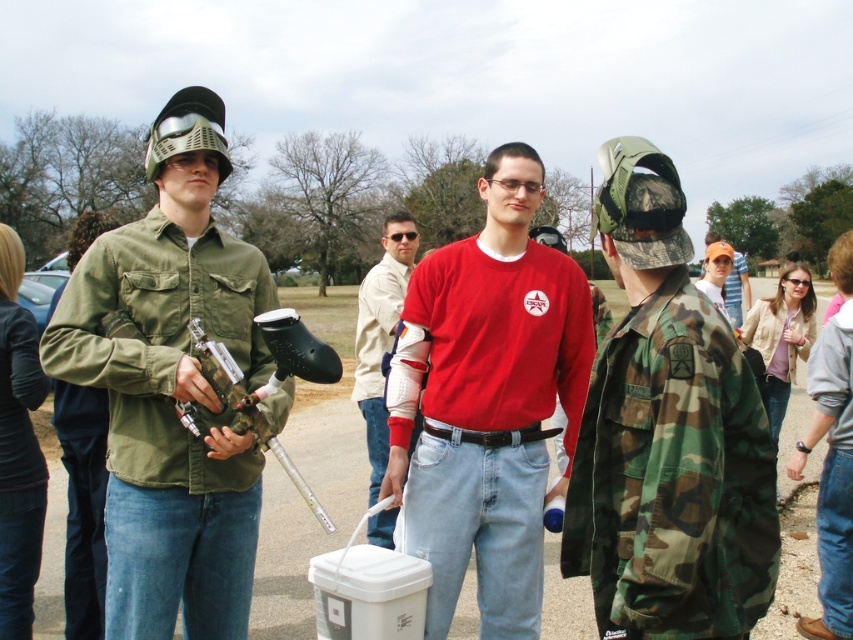
You are a photographer trying to capture the scene of the paintball game. You notice two jackets in the center area labeled as camo fabric jacket at center and camouflage jacket at center. Which jacket is positioned lower in the image?

The camo fabric jacket at center is positioned below the camouflage jacket at center, so the camo fabric jacket at center is lower in the image.